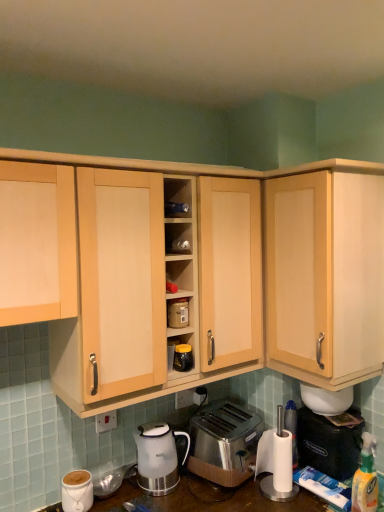
I want to click on matte plastic container at center, so click(178, 313).

What is the approximate width of matte plastic container at center?

3.34 inches.

This screenshot has height=512, width=384. I want to click on black plastic coffee machine at lower right, so click(329, 444).

What is the approximate height of light wood cabinet at upper left, acting as the first cabinetry starting from the left?

The height of light wood cabinet at upper left, acting as the first cabinetry starting from the left, is 50.33 centimeters.

Find the location of a particular element. This screenshot has width=384, height=512. satin white kettle at lower center is located at coordinates (158, 457).

Find the location of a particular element. matte plastic container at center is located at coordinates (178, 313).

From a real-world perspective, between matte white coffee cup at lower left and light wood cabinet at center, the second cabinetry positioned from the left, who is vertically higher?

light wood cabinet at center, the second cabinetry positioned from the left, is physically above.

Is the depth of matte white coffee cup at lower left greater than that of light wood cabinet at center, the 2th cabinetry in the right-to-left sequence?

Yes, it is behind light wood cabinet at center, the 2th cabinetry in the right-to-left sequence.

Is light wood cabinet at center, the 2th cabinetry in the right-to-left sequence, completely or partially inside matte white coffee cup at lower left?

No, light wood cabinet at center, the 2th cabinetry in the right-to-left sequence, is not inside matte white coffee cup at lower left.

From the image's perspective, which one is positioned lower, matte plastic container at center or light wood cabinet at upper left, which appears as the 3th cabinetry when viewed from the right?

matte plastic container at center is shown below in the image.

From a real-world perspective, between matte plastic container at center and light wood cabinet at upper left, which appears as the 3th cabinetry when viewed from the right, who is vertically lower?

From a 3D spatial view, matte plastic container at center is below.

Is matte plastic container at center aimed at light wood cabinet at upper left, acting as the first cabinetry starting from the left?

No, matte plastic container at center is not oriented towards light wood cabinet at upper left, acting as the first cabinetry starting from the left.

Does matte plastic container at center have a greater height compared to light wood cabinet at upper left, acting as the first cabinetry starting from the left?

In fact, matte plastic container at center may be shorter than light wood cabinet at upper left, acting as the first cabinetry starting from the left.

Considering the sizes of objects light wood cabinet at upper left, which appears as the 3th cabinetry when viewed from the right, and matte white coffee cup at lower left in the image provided, who is smaller, light wood cabinet at upper left, which appears as the 3th cabinetry when viewed from the right, or matte white coffee cup at lower left?

With smaller size is matte white coffee cup at lower left.

Looking at this image, is light wood cabinet at upper left, acting as the first cabinetry starting from the left, inside the boundaries of matte white coffee cup at lower left, or outside?

light wood cabinet at upper left, acting as the first cabinetry starting from the left, cannot be found inside matte white coffee cup at lower left.

Is the surface of light wood cabinet at upper left, which appears as the 3th cabinetry when viewed from the right, in direct contact with matte white coffee cup at lower left?

light wood cabinet at upper left, which appears as the 3th cabinetry when viewed from the right, is not next to matte white coffee cup at lower left, and they're not touching.

From the image's perspective, is light wood cabinet at upper left, which appears as the 3th cabinetry when viewed from the right, on top of matte white coffee cup at lower left?

Indeed, from the image's perspective, light wood cabinet at upper left, which appears as the 3th cabinetry when viewed from the right, is shown above matte white coffee cup at lower left.

Does light wood cabinet at upper left, which appears as the 3th cabinetry when viewed from the right, appear on the left side of white plastic bottle at lower right, the 1th bottle when ordered from left to right?

Yes.

From the image's perspective, is light wood cabinet at upper left, which appears as the 3th cabinetry when viewed from the right, on white plastic bottle at lower right, the second bottle in the right-to-left sequence?

Indeed, from the image's perspective, light wood cabinet at upper left, which appears as the 3th cabinetry when viewed from the right, is shown above white plastic bottle at lower right, the second bottle in the right-to-left sequence.

Do you think light wood cabinet at upper left, acting as the first cabinetry starting from the left, is within white plastic bottle at lower right, the second bottle in the front-to-back sequence, or outside of it?

light wood cabinet at upper left, acting as the first cabinetry starting from the left, lies outside white plastic bottle at lower right, the second bottle in the front-to-back sequence.

From a real-world perspective, is light wood cabinet at upper left, acting as the first cabinetry starting from the left, located higher than white plastic bottle at lower right, the 1th bottle in the back-to-front sequence?

Yes, from a real-world perspective, light wood cabinet at upper left, acting as the first cabinetry starting from the left, is on top of white plastic bottle at lower right, the 1th bottle in the back-to-front sequence.

Is matte white coffee cup at lower left closer to camera compared to black plastic coffee machine at lower right?

Yes, matte white coffee cup at lower left is in front of black plastic coffee machine at lower right.

Considering the relative sizes of matte white coffee cup at lower left and black plastic coffee machine at lower right in the image provided, is matte white coffee cup at lower left bigger than black plastic coffee machine at lower right?

Incorrect, matte white coffee cup at lower left is not larger than black plastic coffee machine at lower right.

Considering the sizes of objects matte white coffee cup at lower left and black plastic coffee machine at lower right in the image provided, who is taller, matte white coffee cup at lower left or black plastic coffee machine at lower right?

black plastic coffee machine at lower right.

Which object is thinner, matte white coffee cup at lower left or black plastic coffee machine at lower right?

With smaller width is matte white coffee cup at lower left.

Considering the sizes of objects light wood cabinet at center, the 2th cabinetry in the right-to-left sequence, and light wood cabinet at upper right, acting as the 1th cabinetry starting from the right, in the image provided, who is smaller, light wood cabinet at center, the 2th cabinetry in the right-to-left sequence, or light wood cabinet at upper right, acting as the 1th cabinetry starting from the right,?

With smaller size is light wood cabinet at upper right, acting as the 1th cabinetry starting from the right.

Is light wood cabinet at center, the second cabinetry positioned from the left, taller or shorter than light wood cabinet at upper right, acting as the 1th cabinetry starting from the right?

Clearly, light wood cabinet at center, the second cabinetry positioned from the left, is shorter compared to light wood cabinet at upper right, acting as the 1th cabinetry starting from the right.

Considering the relative sizes of light wood cabinet at center, the 2th cabinetry in the right-to-left sequence, and light wood cabinet at upper right, placed as the 3th cabinetry when sorted from left to right, in the image provided, is light wood cabinet at center, the 2th cabinetry in the right-to-left sequence, wider than light wood cabinet at upper right, placed as the 3th cabinetry when sorted from left to right,?

Yes.

Is matte white coffee cup at lower left oriented away from light wood cabinet at upper left, which appears as the 3th cabinetry when viewed from the right?

No, light wood cabinet at upper left, which appears as the 3th cabinetry when viewed from the right, is not at the back of matte white coffee cup at lower left.

You are a GUI agent. You are given a task and a screenshot of the screen. Output one action in this format:
    pyautogui.click(x=<x>, y=<y>)
    Task: Click on the coffee cup that is below the light wood cabinet at upper left, which appears as the 3th cabinetry when viewed from the right (from the image's perspective)
    
    Given the screenshot: What is the action you would take?
    pyautogui.click(x=77, y=490)

Measure the distance from matte white coffee cup at lower left to light wood cabinet at upper left, acting as the first cabinetry starting from the left.

A distance of 35.21 inches exists between matte white coffee cup at lower left and light wood cabinet at upper left, acting as the first cabinetry starting from the left.

From the image's perspective, between matte white coffee cup at lower left and light wood cabinet at upper left, which appears as the 3th cabinetry when viewed from the right, who is located below?

matte white coffee cup at lower left.

Locate an element on the screen. This screenshot has height=512, width=384. coffee cup that appears below the light wood cabinet at center, the second cabinetry positioned from the left (from the image's perspective) is located at coordinates (77, 490).

Which cabinetry is the 2nd one when counting from the left side of the matte plastic container at center? Please provide its 2D coordinates.

[(37, 243)]

Looking at the image, which one is located further to light wood cabinet at upper right, acting as the 1th cabinetry starting from the right, black glossy jar at center or stainless steel toaster at lower center?

stainless steel toaster at lower center is further to light wood cabinet at upper right, acting as the 1th cabinetry starting from the right.

Estimate the real-world distances between objects in this image. Which object is closer to black plastic coffee machine at lower right, translucent plastic bottle at lower right, which is counted as the second bottle, starting from the back, or white plastic bottle at lower right, the 1th bottle when ordered from left to right?

white plastic bottle at lower right, the 1th bottle when ordered from left to right, is closer to black plastic coffee machine at lower right.

From the image, which object appears to be farther from black plastic coffee machine at lower right, light wood cabinet at upper right, placed as the 3th cabinetry when sorted from left to right, or white plastic bottle at lower right, the 1th bottle when ordered from left to right?

light wood cabinet at upper right, placed as the 3th cabinetry when sorted from left to right, lies further to black plastic coffee machine at lower right than the other object.

Looking at the image, which one is located further to white plastic electric outlet at lower center, marked as the second electric outlet in a back-to-front arrangement, light wood cabinet at center, the 2th cabinetry in the right-to-left sequence, or white plastic electric outlet at center, acting as the 1th electric outlet starting from the back?

Among the two, light wood cabinet at center, the 2th cabinetry in the right-to-left sequence, is located further to white plastic electric outlet at lower center, marked as the second electric outlet in a back-to-front arrangement.

Which object lies further to the anchor point matte plastic container at center, white plastic electric outlet at center, which ranks as the 1th electric outlet in right-to-left order, or satin white kettle at lower center?

satin white kettle at lower center lies further to matte plastic container at center than the other object.

Based on the photo, considering their positions, is stainless steel toaster at lower center positioned further to light wood cabinet at center, the second cabinetry positioned from the left, than white plastic bottle at lower right, the 1th bottle when ordered from left to right?

white plastic bottle at lower right, the 1th bottle when ordered from left to right, is further to light wood cabinet at center, the second cabinetry positioned from the left.

Which object lies nearer to the anchor point white plastic bottle at lower right, the second bottle in the right-to-left sequence, satin white kettle at lower center or black plastic coffee machine at lower right?

Based on the image, black plastic coffee machine at lower right appears to be nearer to white plastic bottle at lower right, the second bottle in the right-to-left sequence.

Estimate the real-world distances between objects in this image. Which object is further from light wood cabinet at upper right, placed as the 3th cabinetry when sorted from left to right, matte plastic container at center or stainless steel toaster at lower center?

stainless steel toaster at lower center lies further to light wood cabinet at upper right, placed as the 3th cabinetry when sorted from left to right, than the other object.

Identify the location of coffee cup situated between light wood cabinet at upper left, which appears as the 3th cabinetry when viewed from the right, and translucent plastic bottle at lower right, which is counted as the second bottle, starting from the back, from left to right. This screenshot has height=512, width=384. (77, 490).

The image size is (384, 512). In order to click on beverage between matte plastic container at center and white plastic electric outlet at center, acting as the 1th electric outlet starting from the back, from top to bottom in this screenshot , I will do `click(183, 358)`.

The image size is (384, 512). I want to click on toaster located between white plastic electric outlet at lower center, the first electric outlet in the front-to-back sequence, and black plastic coffee machine at lower right in the left-right direction, so click(224, 443).

Find the location of a particular element. coffee maker between light wood cabinet at upper left, which appears as the 3th cabinetry when viewed from the right, and stainless steel toaster at lower center vertically is located at coordinates 158,457.